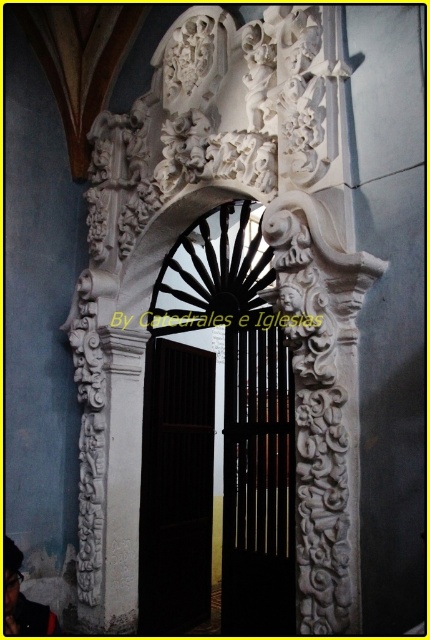
Based on the photo, you are standing in front of a historical building with two doors. The scene includes a white carved wood door at center and a black polished wood door at center. Which door is positioned higher?

The white carved wood door at center is above the black polished wood door at center, so the white carved wood door at center is positioned higher.